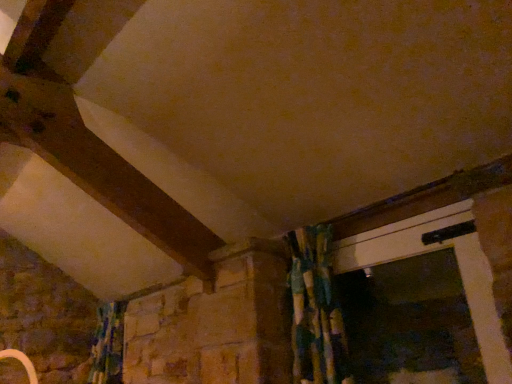
This screenshot has height=384, width=512. I want to click on multicolored fabric shower curtain at lower left, so click(108, 345).

What do you see at coordinates (108, 345) in the screenshot? I see `multicolored fabric shower curtain at lower left` at bounding box center [108, 345].

Consider the image. Measure the distance between point (x=117, y=330) and camera.

The depth of point (x=117, y=330) is 3.42 meters.

In order to face multicolored fabric shower curtain at lower left, should I rotate leftwards or rightwards?

Turn left by 20.437 degrees to look at multicolored fabric shower curtain at lower left.

Measure the distance between multicolored fabric shower curtain at lower left and camera.

multicolored fabric shower curtain at lower left is 3.06 meters from camera.

Identify the location of multicolored fabric shower curtain at lower left. This screenshot has width=512, height=384. (108, 345).